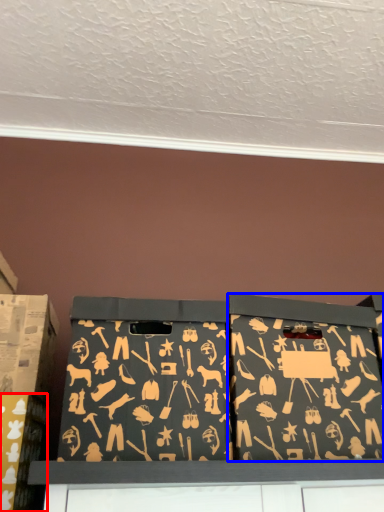
Question: Which of the following is the closest to the observer, box (highlighted by a red box) or box (highlighted by a blue box)?

Choices:
 (A) box
 (B) box

Answer: (B)